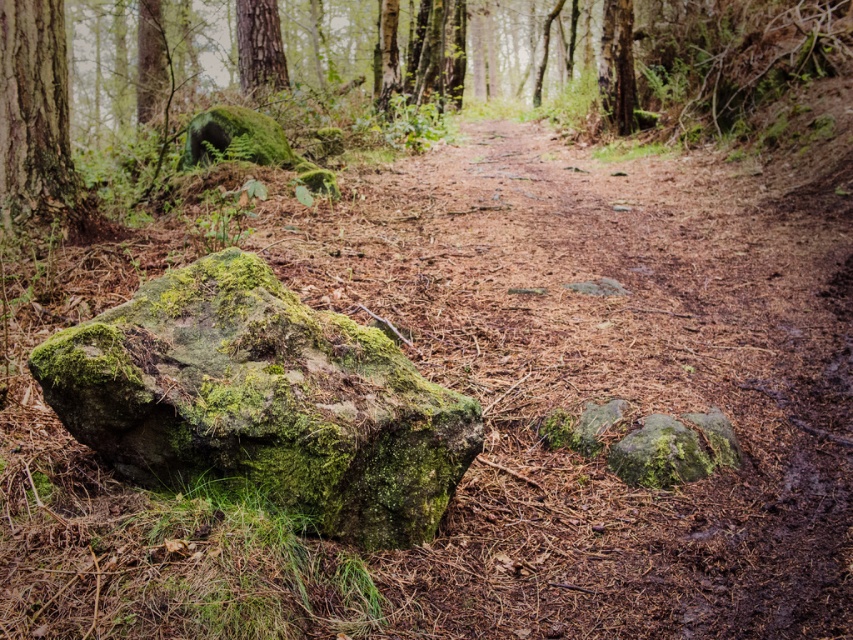
Question: Is smooth bark tree trunk at left smaller than green mossy bark tree at upper left?

Choices:
 (A) yes
 (B) no

Answer: (A)

Question: Is smooth bark tree trunk at left below green mossy bark tree at upper left?

Choices:
 (A) yes
 (B) no

Answer: (A)

Question: Which of these objects is positioned farthest from the green mossy rock at left?

Choices:
 (A) green mossy bark tree at upper left
 (B) smooth bark tree trunk at left

Answer: (A)

Question: Does smooth bark tree trunk at left have a larger size compared to green mossy bark tree at upper left?

Choices:
 (A) yes
 (B) no

Answer: (B)

Question: Considering the real-world distances, which object is farthest from the green mossy bark tree at upper left?

Choices:
 (A) green mossy rock at left
 (B) smooth bark tree trunk at left

Answer: (A)

Question: Among these points, which one is nearest to the camera?

Choices:
 (A) (25, 72)
 (B) (138, 387)
 (C) (247, 13)

Answer: (B)